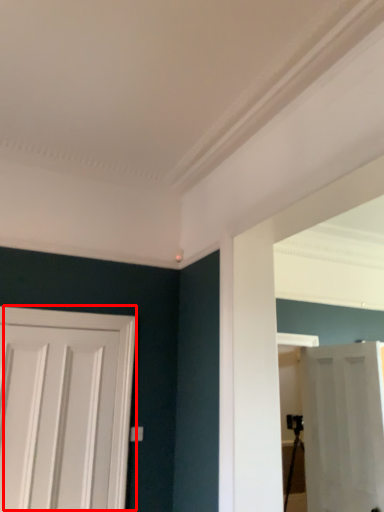
Question: Observing the image, what is the correct spatial positioning of door (annotated by the red box) in reference to door?

Choices:
 (A) left
 (B) right

Answer: (A)